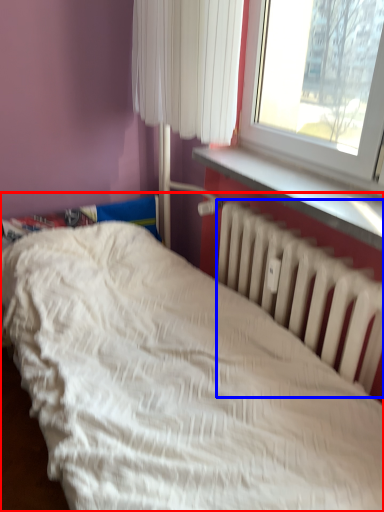
Question: Which object appears closest to the camera in this image, bed (highlighted by a red box) or radiator (highlighted by a blue box)?

Choices:
 (A) bed
 (B) radiator

Answer: (A)